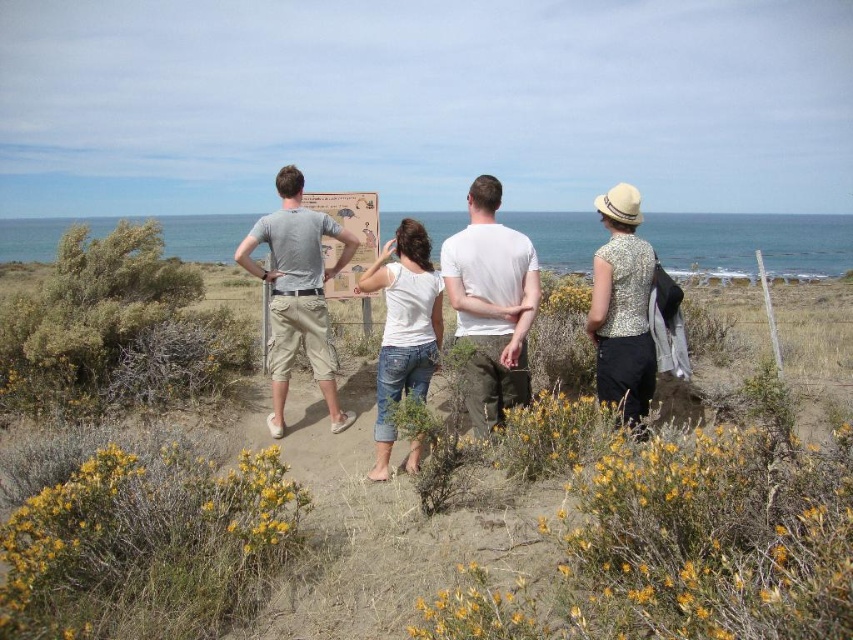
Question: Does yellow fuzzy bush at lower left appear on the right side of matte gray t-shirt at center?

Choices:
 (A) yes
 (B) no

Answer: (B)

Question: Which point is closer to the camera?

Choices:
 (A) (119, 612)
 (B) (302, 337)
 (C) (469, 284)

Answer: (A)

Question: Considering the relative positions of yellow fuzzy bush at lower left and white matte shirt at center in the image provided, where is yellow fuzzy bush at lower left located with respect to white matte shirt at center?

Choices:
 (A) below
 (B) above

Answer: (A)

Question: Which point appears closest to the camera in this image?

Choices:
 (A) (157, 605)
 (B) (283, 291)
 (C) (558, 404)

Answer: (A)

Question: Does yellow fuzzy bush at lower center have a smaller size compared to white matte shirt at center?

Choices:
 (A) no
 (B) yes

Answer: (A)

Question: Which point is farther from the camera taking this photo?

Choices:
 (A) (260, 464)
 (B) (460, 630)
 (C) (525, 380)

Answer: (C)